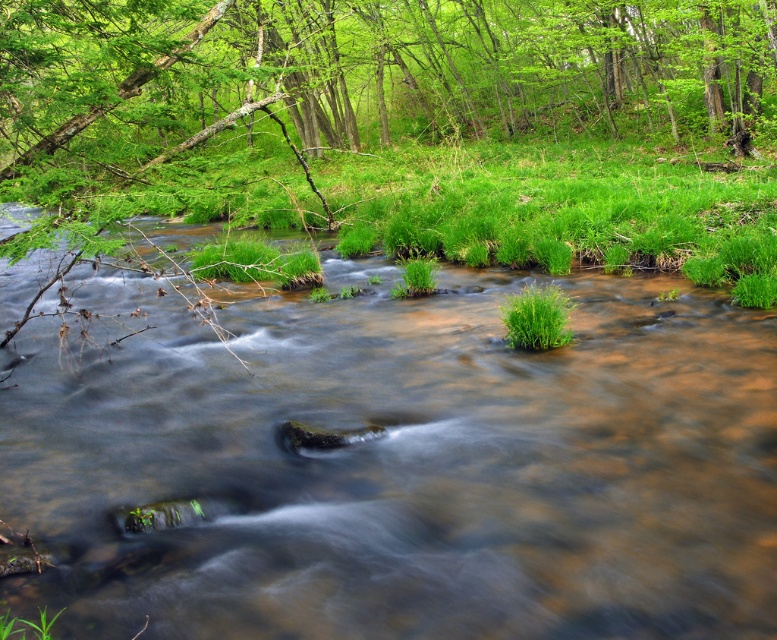
Question: Among these objects, which one is nearest to the camera?

Choices:
 (A) green leafy grass at center
 (B) green leafy tree at upper center
 (C) brown muddy stream at center

Answer: (C)

Question: Which point is closer to the camera taking this photo?

Choices:
 (A) (772, 374)
 (B) (563, 312)
 (C) (211, 150)

Answer: (A)

Question: Is brown muddy stream at center bigger than green leafy grass at center?

Choices:
 (A) yes
 (B) no

Answer: (A)

Question: Is green leafy tree at upper center to the right of green leafy grass at center from the viewer's perspective?

Choices:
 (A) no
 (B) yes

Answer: (A)

Question: Which object is the closest to the green leafy grass at center?

Choices:
 (A) green leafy tree at upper center
 (B) brown muddy stream at center

Answer: (B)

Question: Can you confirm if green leafy tree at upper center is positioned below green leafy grass at center?

Choices:
 (A) yes
 (B) no

Answer: (B)